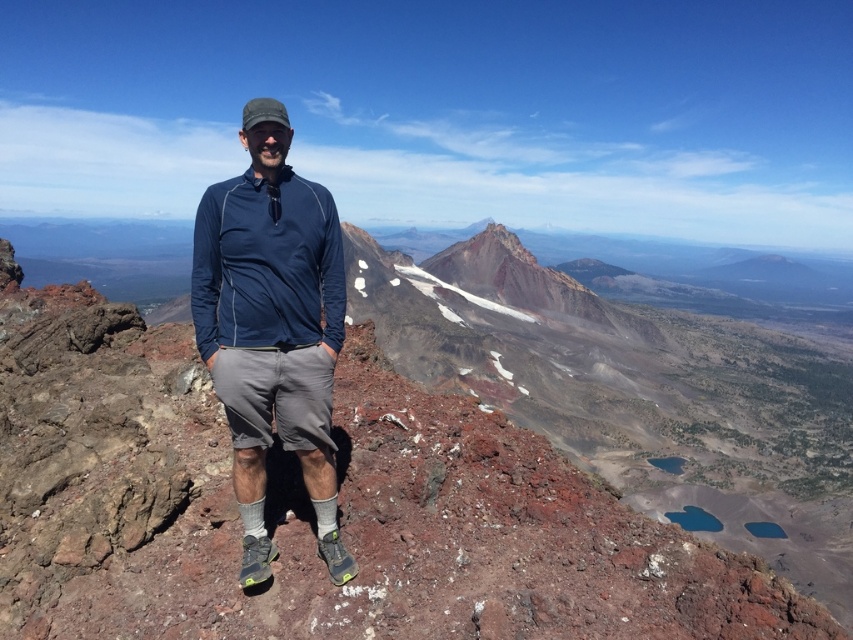
You are planning to place a small flag at the point marked by coordinates point (340, 493). What type of terrain will the flag be placed on?

The flag will be placed on rustic volcanic rock at center, as the coordinates point (340, 493) corresponds to that terrain.

You are a photographer planning to take a portrait of the person in the scene. The rustic volcanic rock at center and the navy blue fabric shirt at center are both visible in the frame. Which object will appear larger in the photo?

The rustic volcanic rock at center will appear larger in the photo because it has a greater height compared to the navy blue fabric shirt at center.